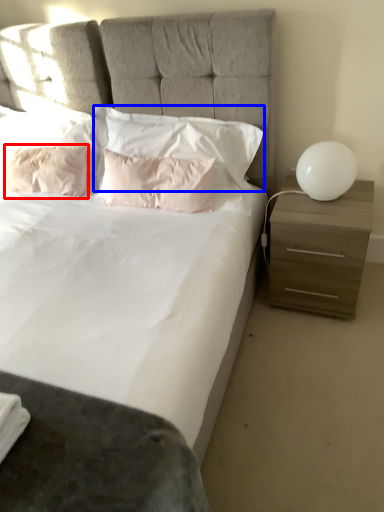
Question: Which object appears farthest to the camera in this image, pillow (highlighted by a red box) or pillow (highlighted by a blue box)?

Choices:
 (A) pillow
 (B) pillow

Answer: (A)